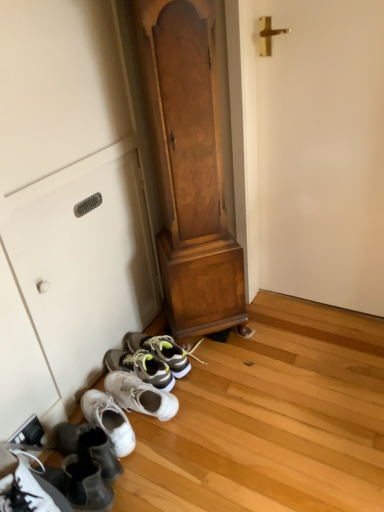
This screenshot has width=384, height=512. I want to click on vacant area that is situated to the right of white matte cabinet at lower left, so click(x=228, y=373).